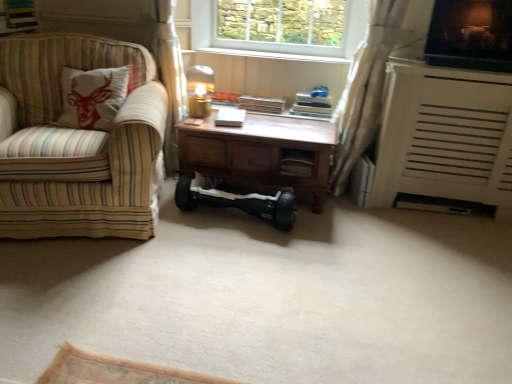
Where is `vacant region below black rubber hoverboard at center (from a real-world perspective)`? vacant region below black rubber hoverboard at center (from a real-world perspective) is located at coordinates click(233, 221).